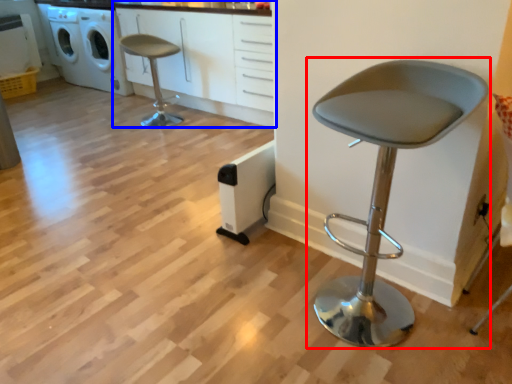
Question: Which object is closer to the camera taking this photo, chair (highlighted by a red box) or cabinetry (highlighted by a blue box)?

Choices:
 (A) chair
 (B) cabinetry

Answer: (A)